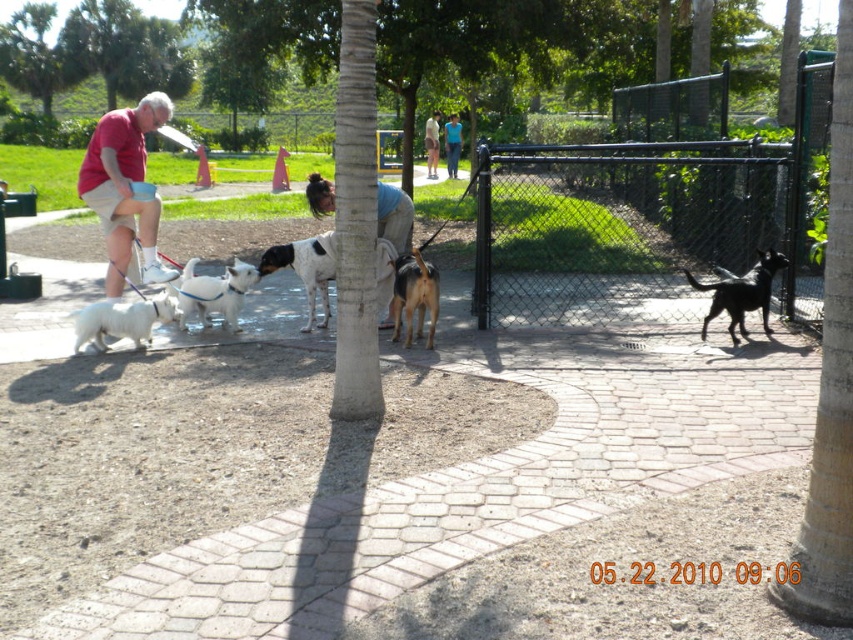
Question: Which is farther from the matte red shirt at left?

Choices:
 (A) white matte dog at center
 (B) black and white spotted dog at center
 (C) black glossy dog at right

Answer: (C)

Question: Considering the relative positions of brown fur dog at center and light blue denim shorts at center in the image provided, where is brown fur dog at center located with respect to light blue denim shorts at center?

Choices:
 (A) right
 (B) left

Answer: (A)

Question: Estimate the real-world distances between objects in this image. Which object is farther from the blue denim jacket at center?

Choices:
 (A) light blue denim shorts at center
 (B) blue fabric shirt at upper center
 (C) brown fur dog at center
 (D) white matte dog at center

Answer: (A)

Question: Which point appears farthest from the camera in this image?

Choices:
 (A) (447, 147)
 (B) (144, 337)
 (C) (109, 193)
 (D) (310, 275)

Answer: (A)

Question: Does black glossy dog at right appear over brown fur dog at center?

Choices:
 (A) yes
 (B) no

Answer: (A)

Question: In this image, where is black and white spotted dog at center located relative to brown fur dog at center?

Choices:
 (A) right
 (B) left

Answer: (B)